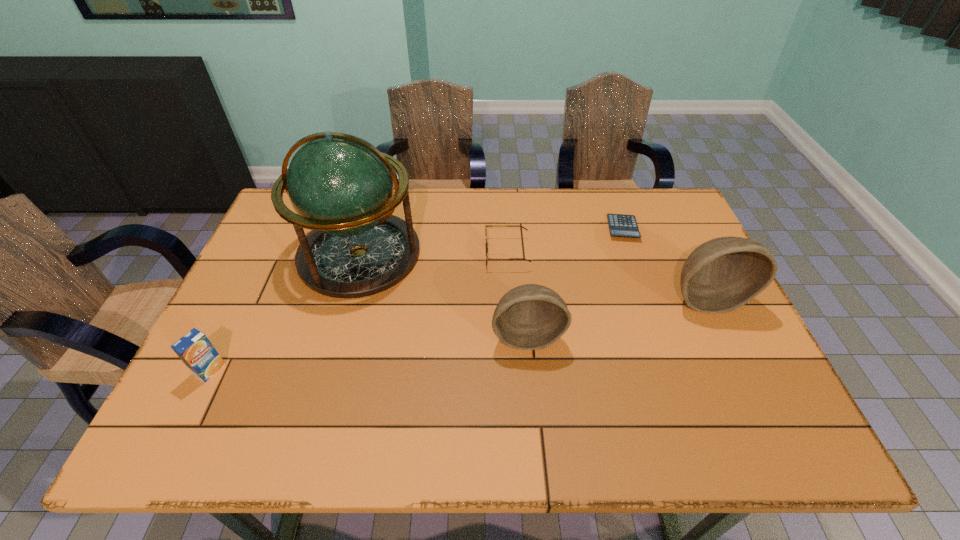
Locate an element on the screen. the left bowl is located at coordinates (529, 317).

Where is `the nearer bowl`? This screenshot has height=540, width=960. the nearer bowl is located at coordinates click(x=529, y=317).

Image resolution: width=960 pixels, height=540 pixels. What are the coordinates of `the right bowl` in the screenshot? It's located at (721, 275).

The height and width of the screenshot is (540, 960). What are the coordinates of `the farther bowl` in the screenshot? It's located at 721,275.

You are a GUI agent. You are given a task and a screenshot of the screen. Output one action in this format:
    pyautogui.click(x=<x>, y=<y>)
    Task: Click on the fifth object from right to left
    Image resolution: width=960 pixels, height=540 pixels.
    Given the screenshot: What is the action you would take?
    pyautogui.click(x=341, y=187)

The height and width of the screenshot is (540, 960). What are the coordinates of `globe` in the screenshot? It's located at (341, 187).

Find the location of a particular element. The width and height of the screenshot is (960, 540). the second shortest object is located at coordinates (486, 243).

Find the location of a particular element. Image resolution: width=960 pixels, height=540 pixels. calculator is located at coordinates (621, 225).

In order to click on the nearest object in this screenshot , I will do `click(196, 351)`.

Locate an element on the screen. The height and width of the screenshot is (540, 960). orange_juice is located at coordinates (196, 351).